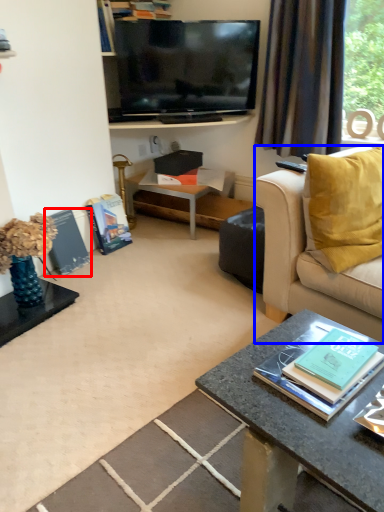
Question: Among these objects, which one is nearest to the camera, magazine (highlighted by a red box) or studio couch (highlighted by a blue box)?

Choices:
 (A) magazine
 (B) studio couch

Answer: (B)